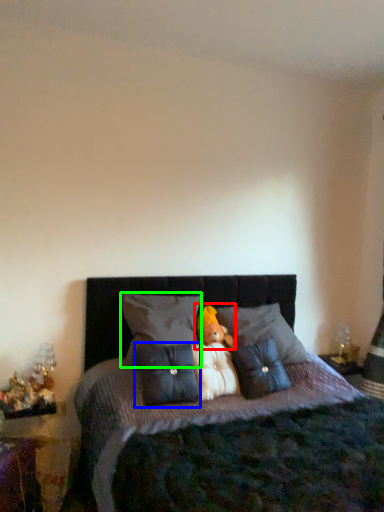
Question: Estimate the real-world distances between objects in this image. Which object is farther from animal (highlighted by a red box), pillow (highlighted by a blue box) or pillow (highlighted by a green box)?

Choices:
 (A) pillow
 (B) pillow

Answer: (A)